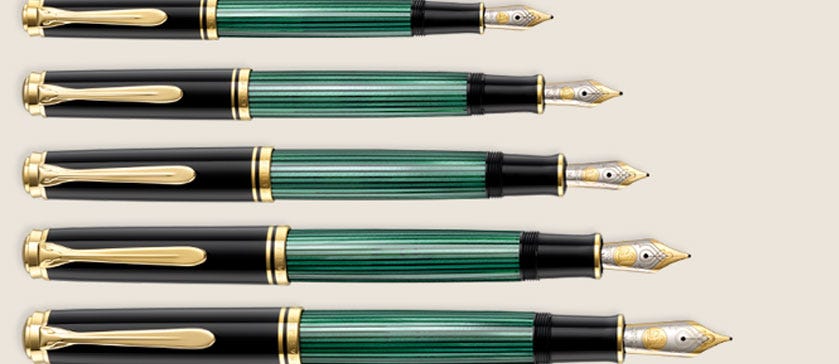
I want to click on pens, so click(180, 26), click(206, 103), click(214, 159), click(233, 253), click(256, 345).